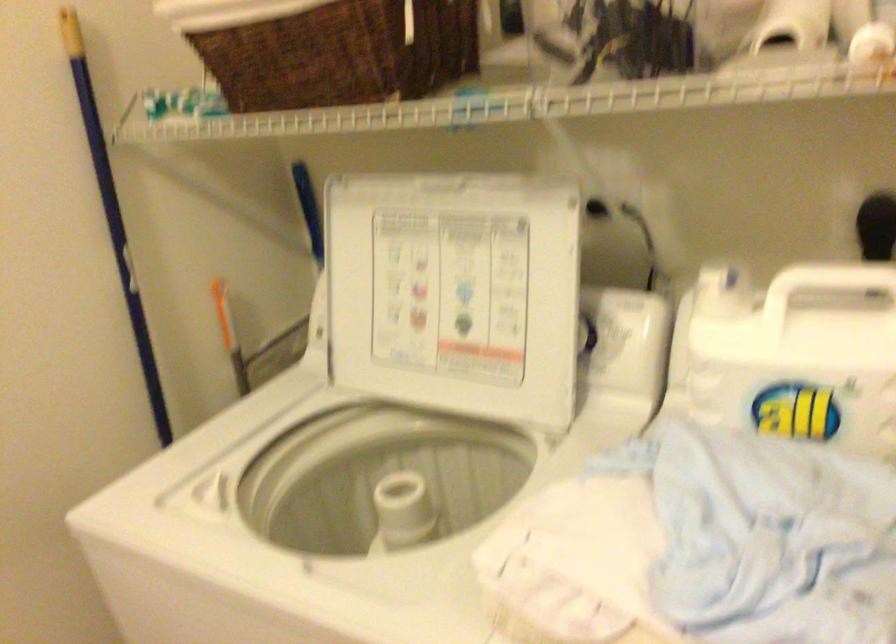
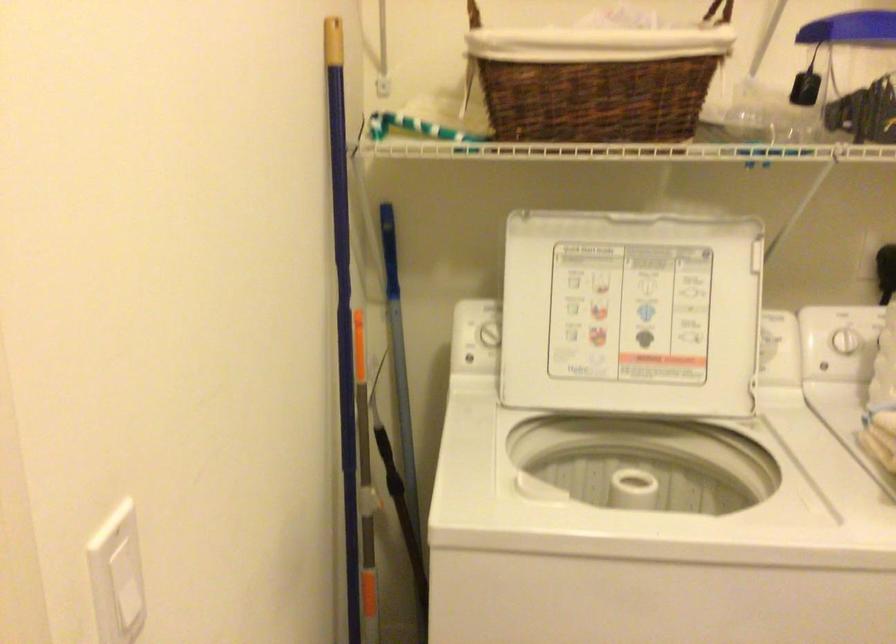
In the second image, find the point that corresponds to pixel 331 308 in the first image.

(488, 334)